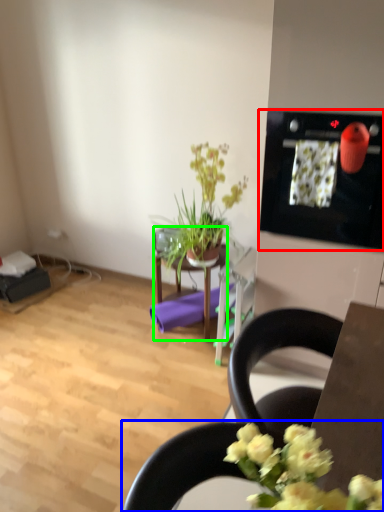
Question: Considering the real-world distances, which object is closest to appliance (highlighted by a red box)? chair (highlighted by a blue box) or table (highlighted by a green box).

Choices:
 (A) chair
 (B) table

Answer: (B)